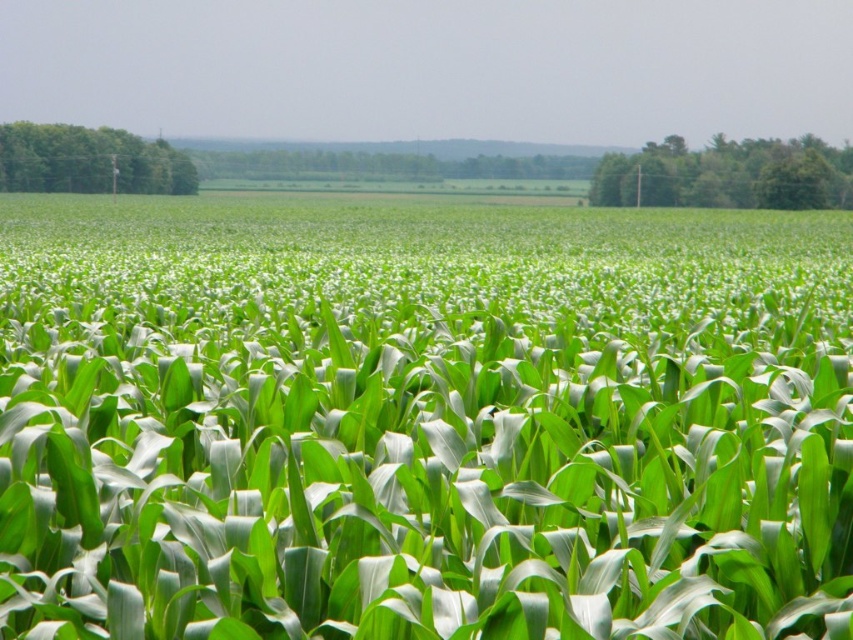
You are a farmer checking the growth of your crops. You notice the green leafy corn at center and the green leafy tree at upper right in the distance. Which one is taller?

The green leafy tree at upper right is taller than the green leafy corn at center.

You are standing in the middle of the cornfield and see the green leafy corn at center and the green leafy tree at upper right. Which object is closer to the horizon?

The green leafy tree at upper right is closer to the horizon because the green leafy corn at center is below it.

You are a farmer standing between the green leafy tree at upper right and the green leafy tree at left. You want to walk directly to the tree that is farther away from you. Which tree should you walk towards?

The green leafy tree at upper right is 48.05 meters away from the green leafy tree at left. Since you are standing between them, the tree farther away would depend on your exact position. However, without specific positioning details, it is impossible to determine which tree is farther away.